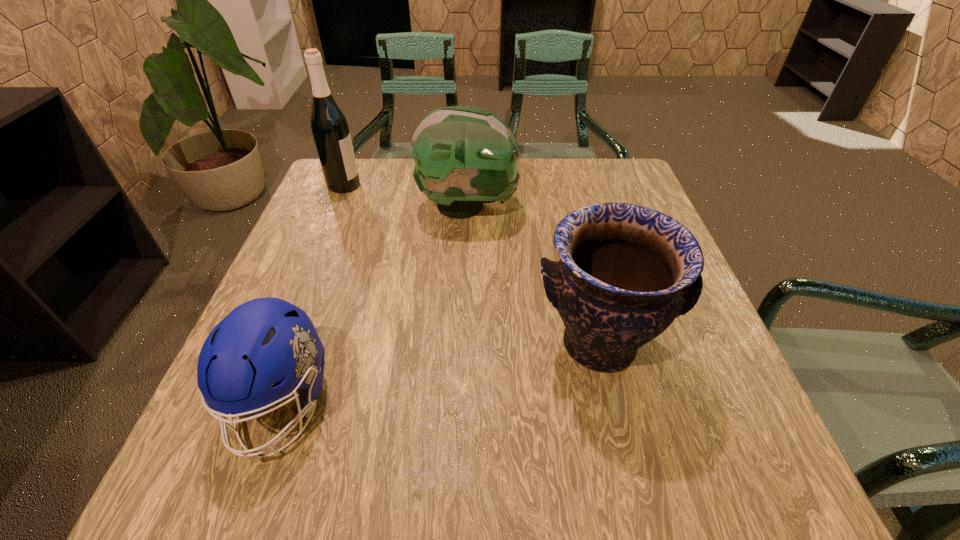
What are the coordinates of `vacant space at the far right corner` in the screenshot? It's located at (614, 191).

Identify the location of vacant space at the near right corner of the desktop. (746, 444).

The image size is (960, 540). Identify the location of empty space that is in between the taller football helmet and the shortest object. (374, 305).

Locate an element on the screen. Image resolution: width=960 pixels, height=540 pixels. empty location between the wine bottle and the nearer football helmet is located at coordinates (312, 295).

The image size is (960, 540). What are the coordinates of `unoccupied area between the pottery and the tallest object` in the screenshot? It's located at (471, 265).

Locate an element on the screen. Image resolution: width=960 pixels, height=540 pixels. vacant point located between the pottery and the tallest object is located at coordinates (471, 265).

You are a GUI agent. You are given a task and a screenshot of the screen. Output one action in this format:
    pyautogui.click(x=<x>, y=<y>)
    Task: Click on the blank region between the right football helmet and the wine bottle
    This screenshot has width=960, height=540.
    Given the screenshot: What is the action you would take?
    pyautogui.click(x=406, y=195)

I want to click on blank region between the taller football helmet and the pottery, so click(x=533, y=275).

Image resolution: width=960 pixels, height=540 pixels. Identify the location of free space between the wine bottle and the pottery. (471, 265).

Where is `free space that is in between the wine bottle and the shorter football helmet`? Image resolution: width=960 pixels, height=540 pixels. free space that is in between the wine bottle and the shorter football helmet is located at coordinates (312, 295).